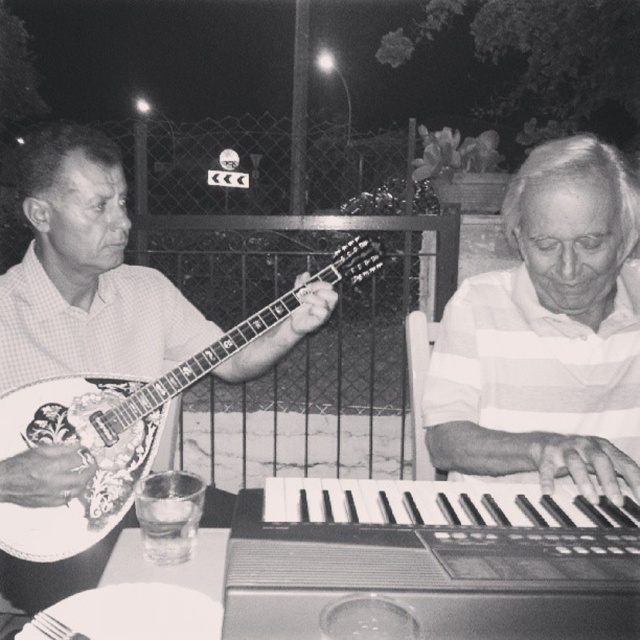
Question: Can you confirm if white striped shirt at right is positioned below decorative wood mandolin at left?

Choices:
 (A) yes
 (B) no

Answer: (A)

Question: Which object appears farthest from the camera in this image?

Choices:
 (A) decorative wood mandolin at left
 (B) white striped shirt at right

Answer: (A)

Question: Can you confirm if white striped shirt at right is thinner than decorative wood mandolin at left?

Choices:
 (A) no
 (B) yes

Answer: (B)

Question: Is white striped shirt at right behind decorative wood mandolin at left?

Choices:
 (A) yes
 (B) no

Answer: (B)